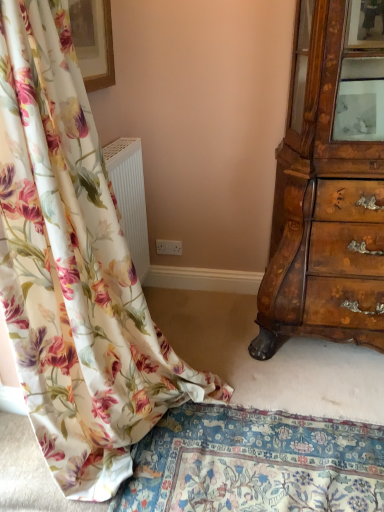
Question: In terms of height, does floral fabric curtain at left look taller or shorter compared to wooden picture frame at upper left?

Choices:
 (A) short
 (B) tall

Answer: (B)

Question: Do you think floral fabric curtain at left is within wooden picture frame at upper left, or outside of it?

Choices:
 (A) inside
 (B) outside

Answer: (B)

Question: From the image's perspective, is floral fabric curtain at left located above or below wooden picture frame at upper left?

Choices:
 (A) above
 (B) below

Answer: (B)

Question: Is wooden picture frame at upper left wider or thinner than floral fabric curtain at left?

Choices:
 (A) wide
 (B) thin

Answer: (B)

Question: From a real-world perspective, is wooden picture frame at upper left physically located above or below floral fabric curtain at left?

Choices:
 (A) below
 (B) above

Answer: (B)

Question: In the image, is wooden picture frame at upper left positioned in front of or behind floral fabric curtain at left?

Choices:
 (A) behind
 (B) front

Answer: (A)

Question: Is wooden picture frame at upper left to the left or to the right of floral fabric curtain at left in the image?

Choices:
 (A) left
 (B) right

Answer: (A)